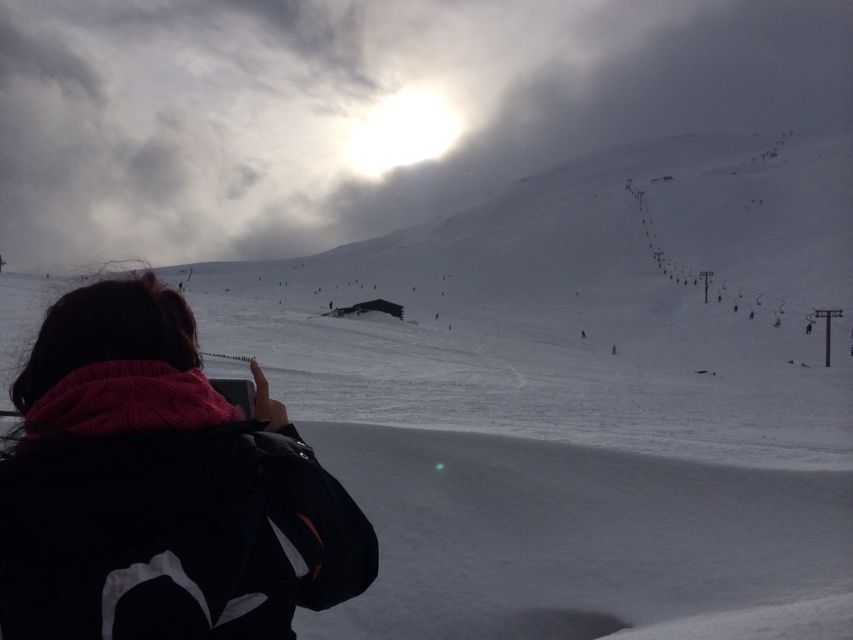
Which is above, cloudy white snow at upper center or black fleece jacket at lower left?

Positioned higher is cloudy white snow at upper center.

Where is `cloudy white snow at upper center`? The width and height of the screenshot is (853, 640). cloudy white snow at upper center is located at coordinates [361, 108].

Where is `cloudy white snow at upper center`? The width and height of the screenshot is (853, 640). cloudy white snow at upper center is located at coordinates pos(361,108).

Where is `cloudy white snow at upper center`? The width and height of the screenshot is (853, 640). cloudy white snow at upper center is located at coordinates (361, 108).